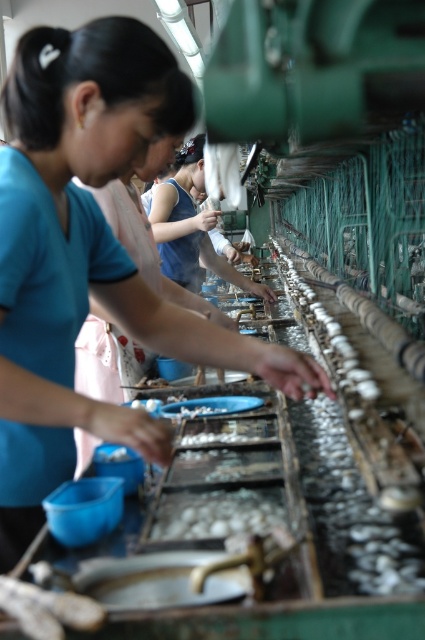
You are a quality inspector in the factory and need to check the position of the matte blue shirt at center relative to the white glossy oyster at center. Which one is on the left side?

The matte blue shirt at center is to the left of the white glossy oyster at center.

Looking at this image, where is the matte blue shirt at center located in the image?

The matte blue shirt at center is located at point (87, 260) in the image.